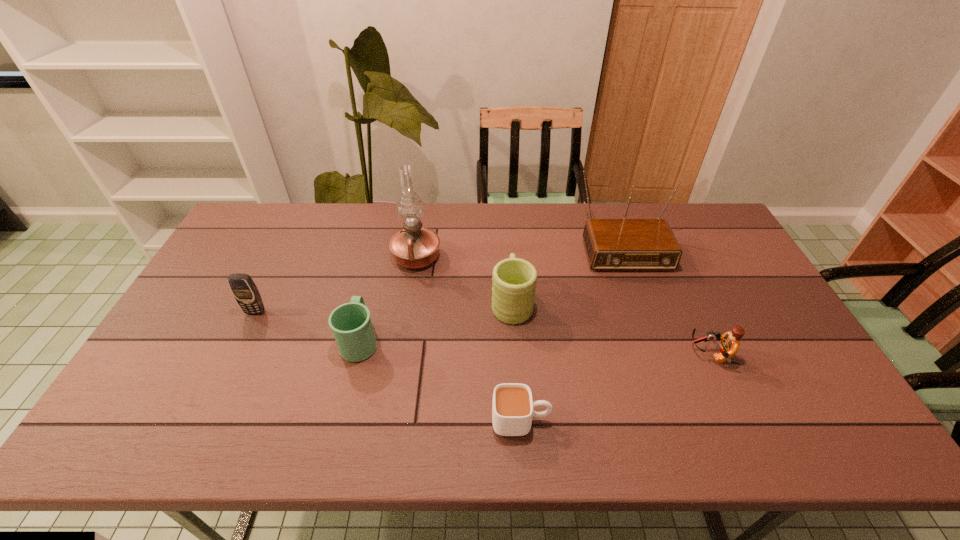
Where is `vacant space situated 0.280m on the side of the taller mug with the handle`? The width and height of the screenshot is (960, 540). vacant space situated 0.280m on the side of the taller mug with the handle is located at coordinates (507, 226).

I want to click on free region located on the side of the taller mug with the handle, so click(508, 239).

Identify the location of free space located 0.130m on the side of the taller mug with the handle. This screenshot has width=960, height=540. (509, 254).

Find the location of `vacant space located 0.130m on the front face of the cellular telephone`. vacant space located 0.130m on the front face of the cellular telephone is located at coordinates (236, 353).

The image size is (960, 540). What are the coordinates of `free location located on the side of the shorter mug with the handle` in the screenshot? It's located at (376, 275).

The width and height of the screenshot is (960, 540). I want to click on vacant region located on the side of the shorter mug with the handle, so click(x=372, y=296).

At what (x,y) coordinates should I click in order to perform the action: click on vacant space located on the side of the shorter mug with the handle. Please return your answer as a coordinate pair (x, y). The image size is (960, 540). Looking at the image, I should click on (386, 236).

What are the coordinates of `vacant area located 0.100m holding a crossbow in the hands of the Lego` in the screenshot? It's located at (653, 355).

Where is `free region located 0.220m holding a crossbow in the hands of the Lego`? This screenshot has width=960, height=540. free region located 0.220m holding a crossbow in the hands of the Lego is located at coordinates (608, 355).

At what (x,y) coordinates should I click in order to perform the action: click on free spot located 0.080m holding a crossbow in the hands of the Lego. Please return your answer as a coordinate pair (x, y). Looking at the image, I should click on (660, 355).